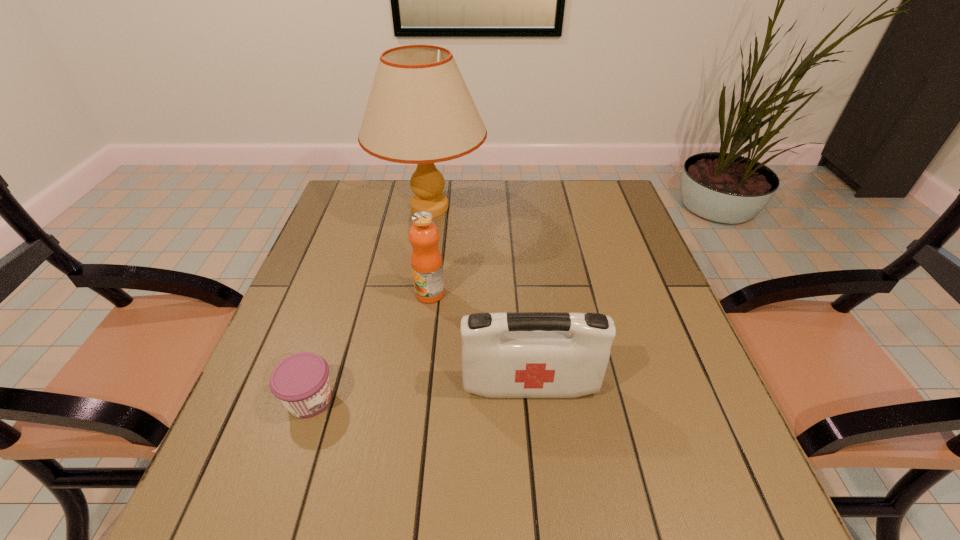
This screenshot has height=540, width=960. In order to click on vacant space that satisfies the following two spatial constraints: 1. on the front side of the fruit juice; 2. on the front label of the jam in this screenshot , I will do `click(417, 399)`.